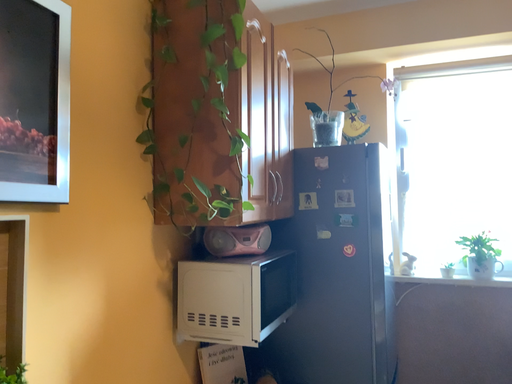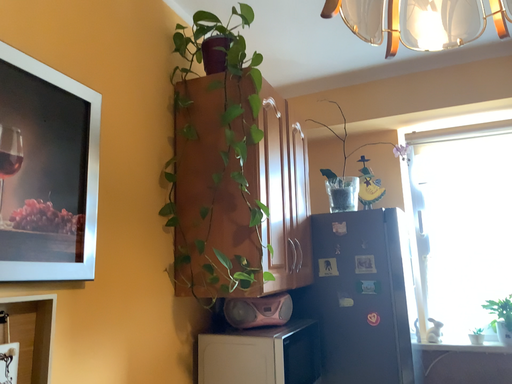
Question: Which way did the camera rotate in the video?

Choices:
 (A) rotated downward
 (B) rotated upward

Answer: (B)